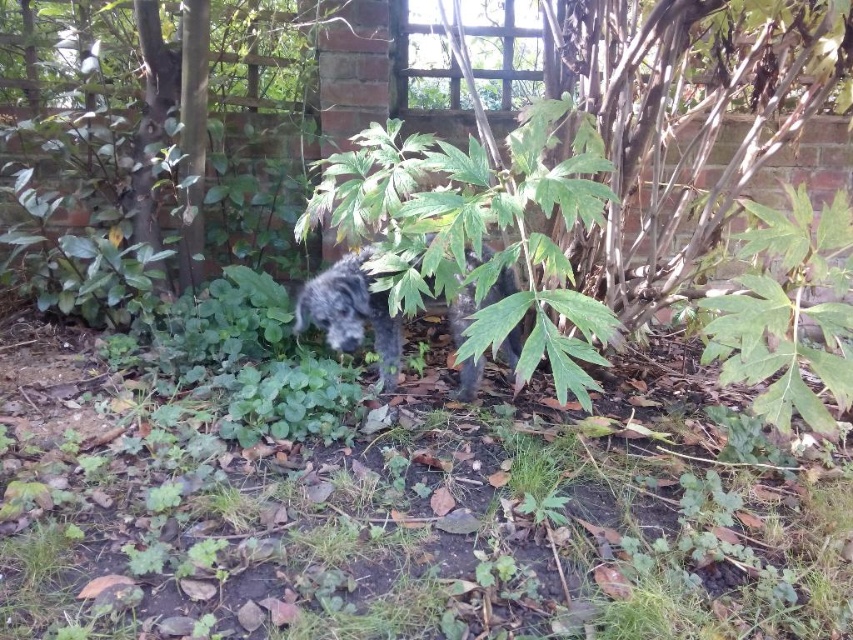
Can you confirm if green leafy plant at center is positioned to the right of shaggy gray dog at center?

Indeed, green leafy plant at center is positioned on the right side of shaggy gray dog at center.

Between green leafy plant at center and shaggy gray dog at center, which one is positioned lower?

shaggy gray dog at center is lower down.

Locate an element on the screen. green leafy plant at center is located at coordinates coord(476,236).

Image resolution: width=853 pixels, height=640 pixels. Identify the location of green leafy plant at center. (476, 236).

Can you confirm if green leafy plant at center is positioned below fuzzy black dog at center?

No, green leafy plant at center is not below fuzzy black dog at center.

Does green leafy plant at center have a lesser height compared to fuzzy black dog at center?

No.

Identify the location of green leafy plant at center. Image resolution: width=853 pixels, height=640 pixels. pyautogui.click(x=476, y=236).

Is green leafy plant at center to the left of green leafy plant at center right from the viewer's perspective?

Indeed, green leafy plant at center is positioned on the left side of green leafy plant at center right.

Can you confirm if green leafy plant at center is wider than green leafy plant at center right?

Yes, green leafy plant at center is wider than green leafy plant at center right.

Where is `green leafy plant at center`? The height and width of the screenshot is (640, 853). green leafy plant at center is located at coordinates (476, 236).